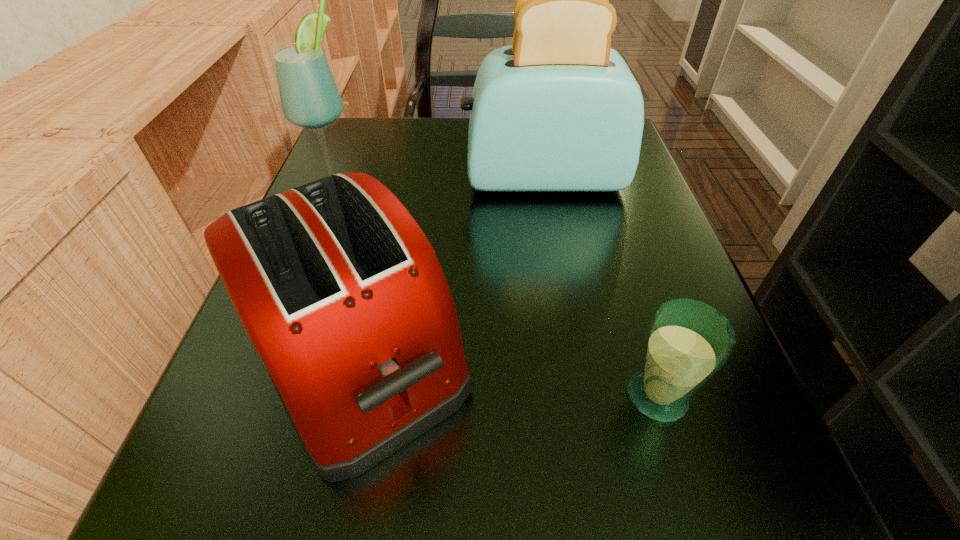
Where is `empty space that is in between the shortest object and the second shortest object`? The height and width of the screenshot is (540, 960). empty space that is in between the shortest object and the second shortest object is located at coordinates (506, 376).

At what (x,y) coordinates should I click in order to perform the action: click on blank region between the shorter toaster and the taller toaster. Please return your answer as a coordinate pair (x, y). The width and height of the screenshot is (960, 540). Looking at the image, I should click on 449,267.

Locate an element on the screen. The height and width of the screenshot is (540, 960). empty location between the taller toaster and the shortest object is located at coordinates (600, 287).

Where is `free spot between the nearer toaster and the shortest object`? The width and height of the screenshot is (960, 540). free spot between the nearer toaster and the shortest object is located at coordinates (506, 376).

Locate an element on the screen. empty location between the taller toaster and the glass is located at coordinates (600, 287).

Identify the location of object that stands as the second closest to the glass. This screenshot has height=540, width=960. (558, 110).

Locate an element on the screen. The width and height of the screenshot is (960, 540). the third closest object to the taller toaster is located at coordinates (688, 341).

What are the coordinates of `free region that satisfies the following two spatial constraints: 1. on the side of the shortest object with the lever; 2. on the right side of the taller toaster` in the screenshot? It's located at (580, 396).

Where is `vacant space that satisfies the following two spatial constraints: 1. on the front side of the shorter toaster; 2. on the right side of the alcohol`? vacant space that satisfies the following two spatial constraints: 1. on the front side of the shorter toaster; 2. on the right side of the alcohol is located at coordinates (273, 355).

The height and width of the screenshot is (540, 960). I want to click on free space that satisfies the following two spatial constraints: 1. on the side of the taller toaster with the lever; 2. on the front side of the shorter toaster, so click(573, 355).